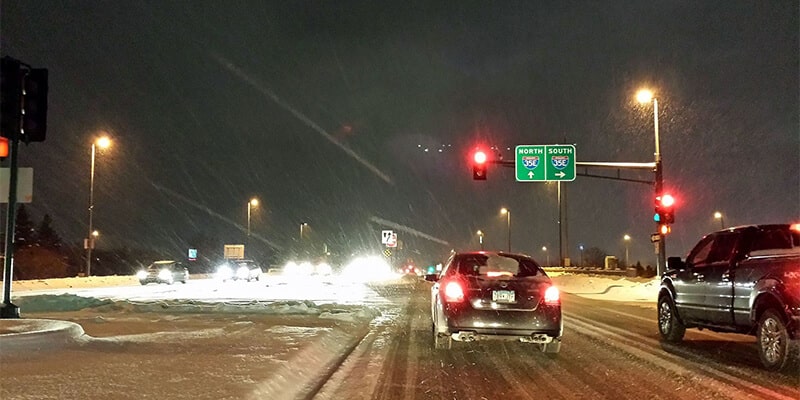
This screenshot has width=800, height=400. In order to click on green light in this screenshot , I will do `click(649, 225)`.